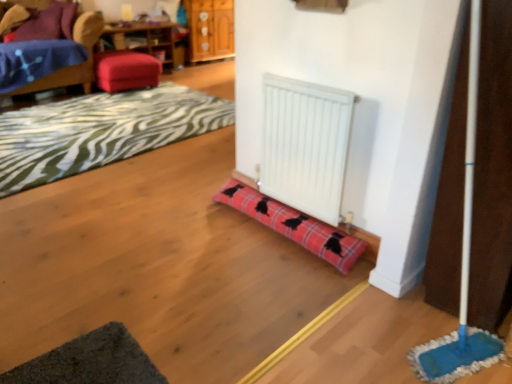
What is the approximate height of wooden table at upper left?

It is 21.61 inches.

Locate an element on the screen. The width and height of the screenshot is (512, 384). blue fabric couch at upper left is located at coordinates (72, 65).

What do you see at coordinates (210, 29) in the screenshot? This screenshot has height=384, width=512. I see `wooden dresser at upper center` at bounding box center [210, 29].

I want to click on velvet red stool at upper left, so click(126, 70).

Locate an element on the screen. The image size is (512, 384). plaid fabric mat at lower left is located at coordinates (100, 131).

Where is `wooden table at upper left`? This screenshot has height=384, width=512. wooden table at upper left is located at coordinates (145, 39).

Between dark gray textured yoga mat at lower left and red plaid doorstop at center, which one has smaller width?

Thinner between the two is red plaid doorstop at center.

From the image's perspective, is dark gray textured yoga mat at lower left above red plaid doorstop at center?

Actually, dark gray textured yoga mat at lower left appears below red plaid doorstop at center in the image.

From a real-world perspective, is dark gray textured yoga mat at lower left above or below red plaid doorstop at center?

Clearly, from a real-world perspective, dark gray textured yoga mat at lower left is below red plaid doorstop at center.

Does dark gray textured yoga mat at lower left have a larger size compared to red plaid doorstop at center?

No.

Locate an element on the screen. Image resolution: width=512 pixels, height=384 pixels. radiator that is above the velvet red stool at upper left (from a real-world perspective) is located at coordinates (305, 145).

Considering the relative sizes of velvet red stool at upper left and white matte radiator at center in the image provided, is velvet red stool at upper left shorter than white matte radiator at center?

Correct, velvet red stool at upper left is not as tall as white matte radiator at center.

Does velvet red stool at upper left have a smaller size compared to white matte radiator at center?

No, velvet red stool at upper left is not smaller than white matte radiator at center.

Which is more to the left, velvet red stool at upper left or white matte radiator at center?

Positioned to the left is velvet red stool at upper left.

Can you confirm if red plaid doorstop at center is bigger than blue fabric couch at upper left?

No.

How different are the orientations of red plaid doorstop at center and blue fabric couch at upper left in degrees?

91.9 degrees separate the facing orientations of red plaid doorstop at center and blue fabric couch at upper left.

Is red plaid doorstop at center to the left of blue fabric couch at upper left from the viewer's perspective?

No.

Is red plaid doorstop at center next to blue fabric couch at upper left and touching it?

red plaid doorstop at center and blue fabric couch at upper left are clearly separated.

Does point (215, 31) come farther from viewer compared to point (170, 64)?

Yes, it is behind point (170, 64).

Considering the relative sizes of wooden dresser at upper center and wooden table at upper left in the image provided, is wooden dresser at upper center thinner than wooden table at upper left?

Yes.

From the picture: Is wooden dresser at upper center positioned far away from wooden table at upper left?

That's not correct — wooden dresser at upper center is a little close to wooden table at upper left.

Locate an element on the screen. This screenshot has height=384, width=512. table in front of the wooden dresser at upper center is located at coordinates (145, 39).

Does point (325, 203) come behind point (197, 56)?

No, it is not.

From the image's perspective, between white matte radiator at center and wooden dresser at upper center, which one is located above?

wooden dresser at upper center is shown above in the image.

Would you say wooden dresser at upper center is part of white matte radiator at center's contents?

No, wooden dresser at upper center is not a part of white matte radiator at center.

From a real-world perspective, who is located lower, white matte radiator at center or wooden dresser at upper center?

wooden dresser at upper center, from a real-world perspective.

Is wooden table at upper left not close to wooden dresser at upper center?

No, there isn't a large distance between wooden table at upper left and wooden dresser at upper center.

From a real-world perspective, is wooden table at upper left physically located above or below wooden dresser at upper center?

Clearly, from a real-world perspective, wooden table at upper left is below wooden dresser at upper center.

Is wooden table at upper left oriented towards wooden dresser at upper center?

No.

Which point is more forward, (146, 22) or (219, 20)?

The point (146, 22) is in front.

Identify the location of yoga mat located below the wooden table at upper left (from the image's perspective). (90, 361).

From the picture: Considering the relative sizes of dark gray textured yoga mat at lower left and wooden table at upper left in the image provided, is dark gray textured yoga mat at lower left thinner than wooden table at upper left?

Indeed, dark gray textured yoga mat at lower left has a lesser width compared to wooden table at upper left.

Based on the photo, is dark gray textured yoga mat at lower left closer to the viewer compared to wooden table at upper left?

Yes, dark gray textured yoga mat at lower left is closer to the camera.

Would you say dark gray textured yoga mat at lower left is a long distance from wooden table at upper left?

Yes, dark gray textured yoga mat at lower left is far from wooden table at upper left.

Identify the location of plaid on the right of dark gray textured yoga mat at lower left. (294, 225).

Find the location of `radiator above the velvet red stool at upper left (from a real-world perspective)`. radiator above the velvet red stool at upper left (from a real-world perspective) is located at coordinates coord(305,145).

When comparing their distances from plaid fabric mat at lower left, does dark gray textured yoga mat at lower left or blue fabric couch at upper left seem further?

dark gray textured yoga mat at lower left.

When comparing their distances from velvet red stool at upper left, does white matte radiator at center or blue fabric couch at upper left seem further?

Based on the image, white matte radiator at center appears to be further to velvet red stool at upper left.

Which object lies nearer to the anchor point wooden table at upper left, red plaid doorstop at center or dark gray textured yoga mat at lower left?

red plaid doorstop at center is positioned closer to the anchor wooden table at upper left.

Looking at the image, which one is located closer to velvet red stool at upper left, dark gray textured yoga mat at lower left or wooden dresser at upper center?

Based on the image, wooden dresser at upper center appears to be nearer to velvet red stool at upper left.

From the picture: Based on their spatial positions, is wooden dresser at upper center or red plaid doorstop at center further from velvet red stool at upper left?

The object further to velvet red stool at upper left is red plaid doorstop at center.

Estimate the real-world distances between objects in this image. Which object is closer to dark gray textured yoga mat at lower left, velvet red stool at upper left or plaid fabric mat at lower left?

plaid fabric mat at lower left is positioned closer to the anchor dark gray textured yoga mat at lower left.

When comparing their distances from velvet red stool at upper left, does red plaid doorstop at center or blue fabric couch at upper left seem further?

Among the two, red plaid doorstop at center is located further to velvet red stool at upper left.

Based on their spatial positions, is dark gray textured yoga mat at lower left or velvet red stool at upper left further from red plaid doorstop at center?

velvet red stool at upper left is further to red plaid doorstop at center.

Where is `stool between blue fabric couch at upper left and red plaid doorstop at center in the horizontal direction`? This screenshot has width=512, height=384. stool between blue fabric couch at upper left and red plaid doorstop at center in the horizontal direction is located at coordinates (126, 70).

Locate an element on the screen. mat located between white matte radiator at center and velvet red stool at upper left in the depth direction is located at coordinates (100, 131).

Image resolution: width=512 pixels, height=384 pixels. I want to click on plaid between blue fabric couch at upper left and white matte radiator at center in the horizontal direction, so click(294, 225).

Locate an element on the screen. Image resolution: width=512 pixels, height=384 pixels. mat positioned between red plaid doorstop at center and wooden dresser at upper center from near to far is located at coordinates (100, 131).